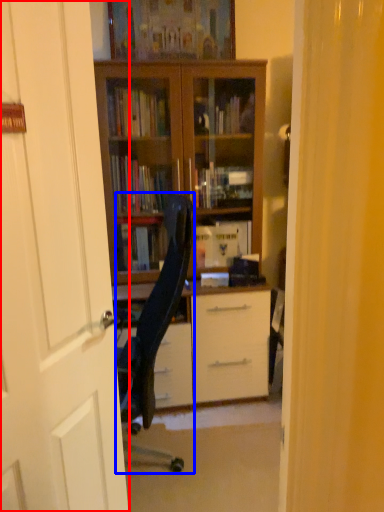
Question: Which of the following is the closest to the observer, door (highlighted by a red box) or chair (highlighted by a blue box)?

Choices:
 (A) door
 (B) chair

Answer: (A)